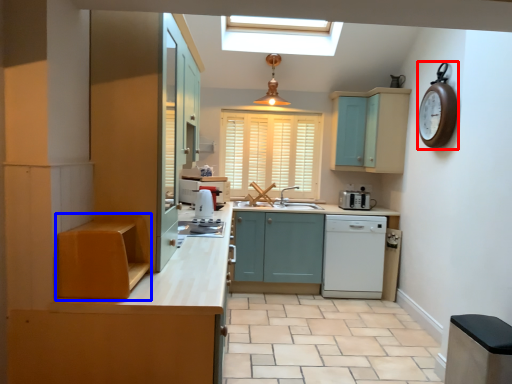
Question: Which object appears farthest to the camera in this image, clock (highlighted by a red box) or cabinetry (highlighted by a blue box)?

Choices:
 (A) clock
 (B) cabinetry

Answer: (A)